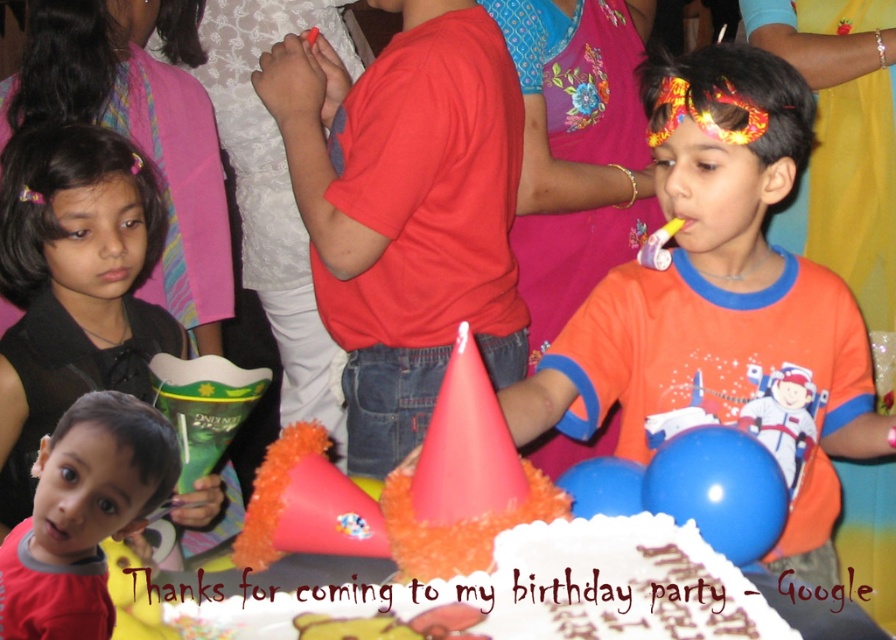
Question: Is orange cotton shirt at center below matte red shirt at lower left?

Choices:
 (A) no
 (B) yes

Answer: (A)

Question: Is white frosted cake at center positioned in front of matte red shirt at lower left?

Choices:
 (A) no
 (B) yes

Answer: (B)

Question: Which point is farther to the camera?

Choices:
 (A) matte red shirt at lower left
 (B) white frosted cake at center

Answer: (A)

Question: Which point is closer to the camera?

Choices:
 (A) white frosted cake at center
 (B) matte red shirt at lower left
 (C) orange cotton shirt at center

Answer: (A)

Question: Which point is closer to the camera taking this photo?

Choices:
 (A) (93, 627)
 (B) (726, 164)

Answer: (A)

Question: Does white frosted cake at center have a greater width compared to matte red shirt at lower left?

Choices:
 (A) no
 (B) yes

Answer: (B)